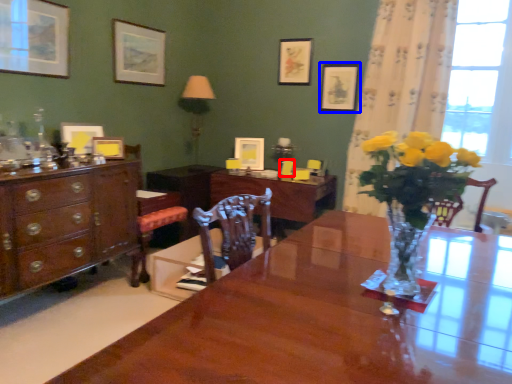
Question: Which object is further to the camera taking this photo, armchair (highlighted by a red box) or picture frame (highlighted by a blue box)?

Choices:
 (A) armchair
 (B) picture frame

Answer: (A)